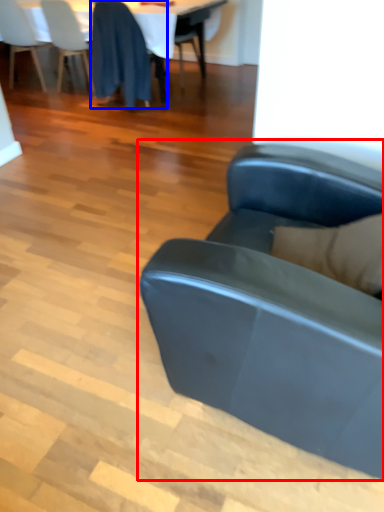
Question: Which object appears closest to the camera in this image, studio couch (highlighted by a red box) or chair (highlighted by a blue box)?

Choices:
 (A) studio couch
 (B) chair

Answer: (A)